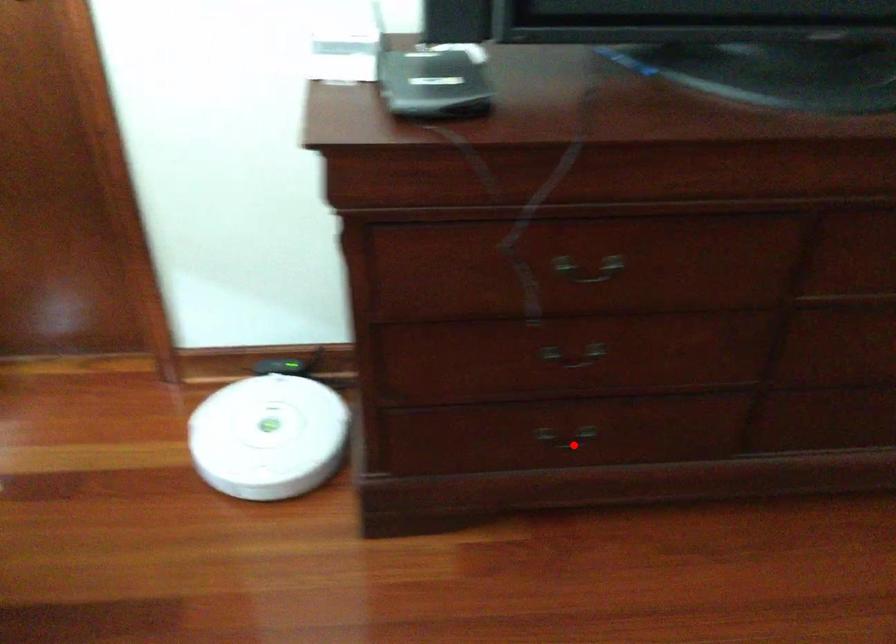
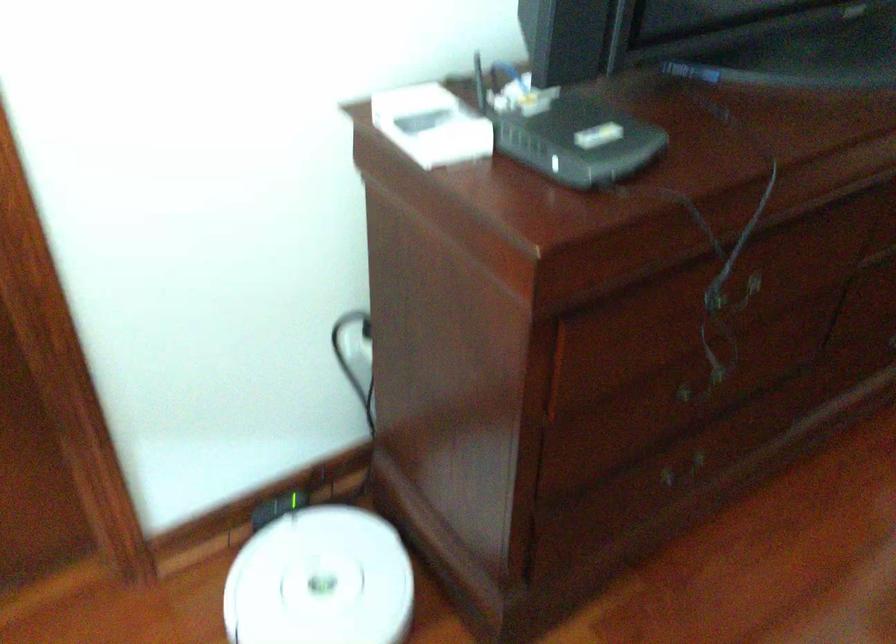
Locate, in the second image, the point that corresponds to the highlighted location in the first image.

(684, 473)